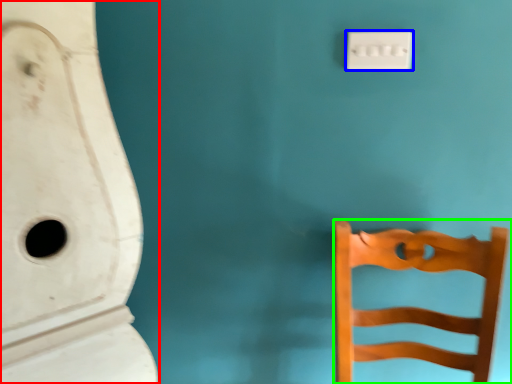
Question: Estimate the real-world distances between objects in this image. Which object is farther from urinal (highlighted by a red box), light switch (highlighted by a blue box) or furniture (highlighted by a green box)?

Choices:
 (A) light switch
 (B) furniture

Answer: (A)